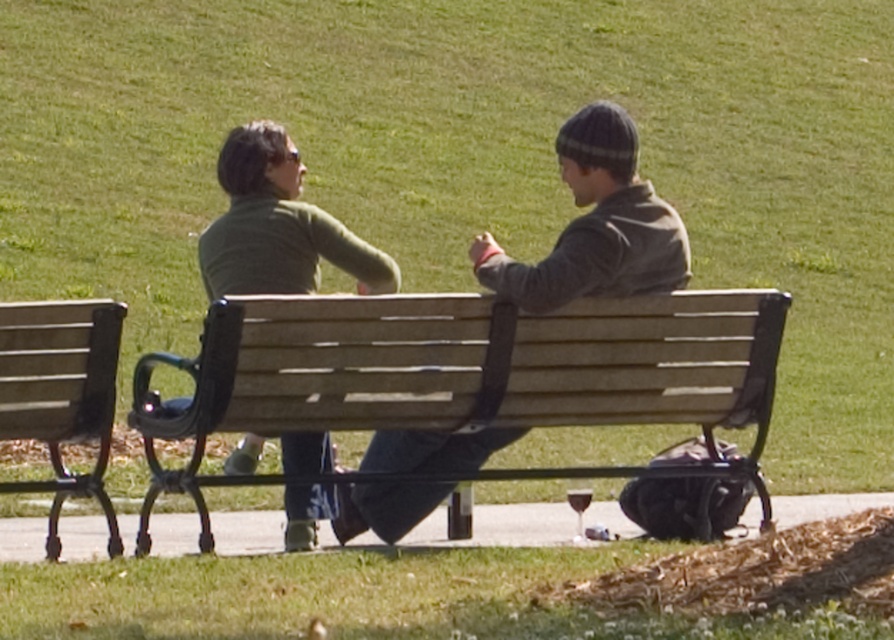
You are planning to place a small potted plant between the wooden bench at center and the matte green sweater at center. Given their sizes, will there be enough space for the plant?

The wooden bench at center is wider than the matte green sweater at center. Since the bench is wider, there should be sufficient space between them to place a small potted plant.